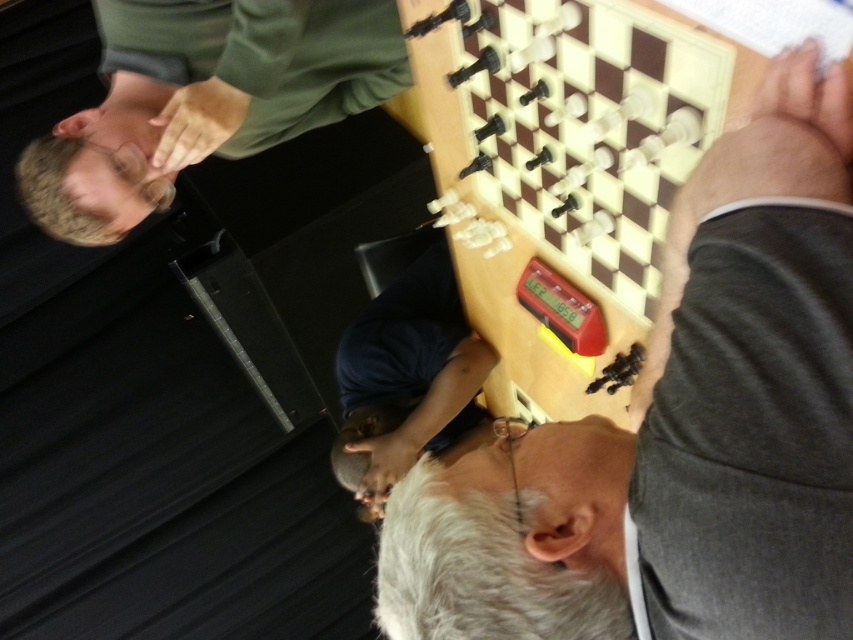
Does smooth wooden chessboard at upper center have a greater width compared to dark blue shirt at center?

In fact, smooth wooden chessboard at upper center might be narrower than dark blue shirt at center.

Is smooth wooden chessboard at upper center closer to camera compared to dark blue shirt at center?

Yes, smooth wooden chessboard at upper center is closer to the viewer.

Does point (816, 577) come farther from viewer compared to point (381, 355)?

No.

Where is `smooth wooden chessboard at upper center`? smooth wooden chessboard at upper center is located at coordinates (677, 429).

In the scene shown: Between smooth wooden chessboard at upper center and green matte shirt at upper left, which one appears on the right side from the viewer's perspective?

From the viewer's perspective, smooth wooden chessboard at upper center appears more on the right side.

Can you confirm if smooth wooden chessboard at upper center is thinner than green matte shirt at upper left?

Yes, smooth wooden chessboard at upper center is thinner than green matte shirt at upper left.

You are a GUI agent. You are given a task and a screenshot of the screen. Output one action in this format:
    pyautogui.click(x=<x>, y=<y>)
    Task: Click on the smooth wooden chessboard at upper center
    This screenshot has height=640, width=853.
    Given the screenshot: What is the action you would take?
    pyautogui.click(x=677, y=429)

Does green matte shirt at upper left have a smaller size compared to dark blue shirt at center?

No.

Who is higher up, green matte shirt at upper left or dark blue shirt at center?

green matte shirt at upper left is above.

Between point (184, 44) and point (335, 456), which one is positioned in front?

Positioned in front is point (184, 44).

This screenshot has width=853, height=640. I want to click on green matte shirt at upper left, so click(202, 99).